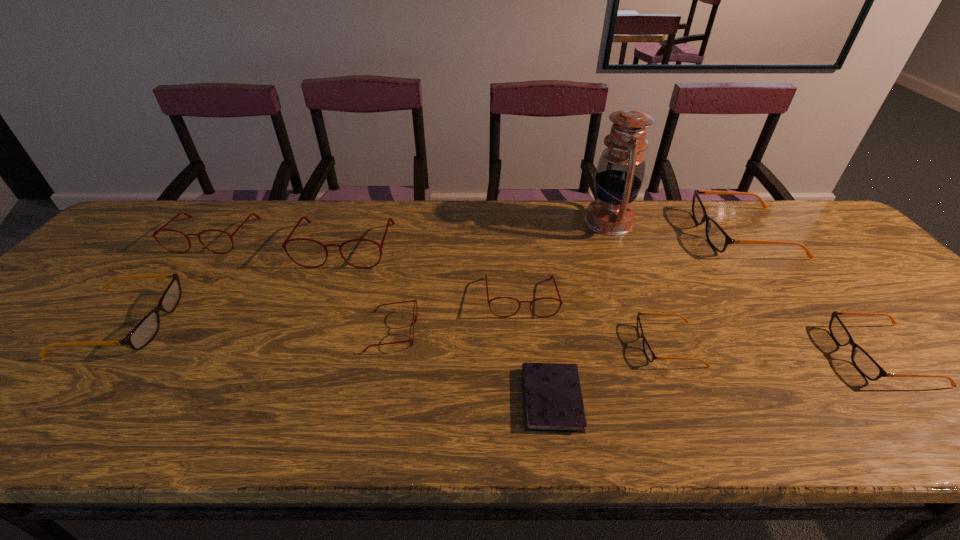
Locate an element on the screen. The width and height of the screenshot is (960, 540). oil lamp situated at the far edge is located at coordinates (620, 171).

I want to click on object located in the near edge section of the desktop, so pos(553,402).

The width and height of the screenshot is (960, 540). I want to click on object at the left edge, so click(x=148, y=327).

Where is `object positioned at the far right corner`? This screenshot has height=540, width=960. object positioned at the far right corner is located at coordinates (717, 237).

Locate an element on the screen. The image size is (960, 540). vacant area at the far edge of the desktop is located at coordinates (736, 222).

Where is `vacant space at the near edge of the desktop`? This screenshot has height=540, width=960. vacant space at the near edge of the desktop is located at coordinates (252, 412).

Where is `vacant region at the left edge`? vacant region at the left edge is located at coordinates (60, 302).

In order to click on vacant space at the right edge of the desktop in this screenshot , I will do `click(908, 371)`.

In the image, there is a desktop. Identify the location of vacant space at the far right corner. (805, 216).

Find the location of a particular element. Image resolution: width=960 pixels, height=540 pixels. empty location between the biggest red spectacles and the third biggest red spectacles is located at coordinates (433, 271).